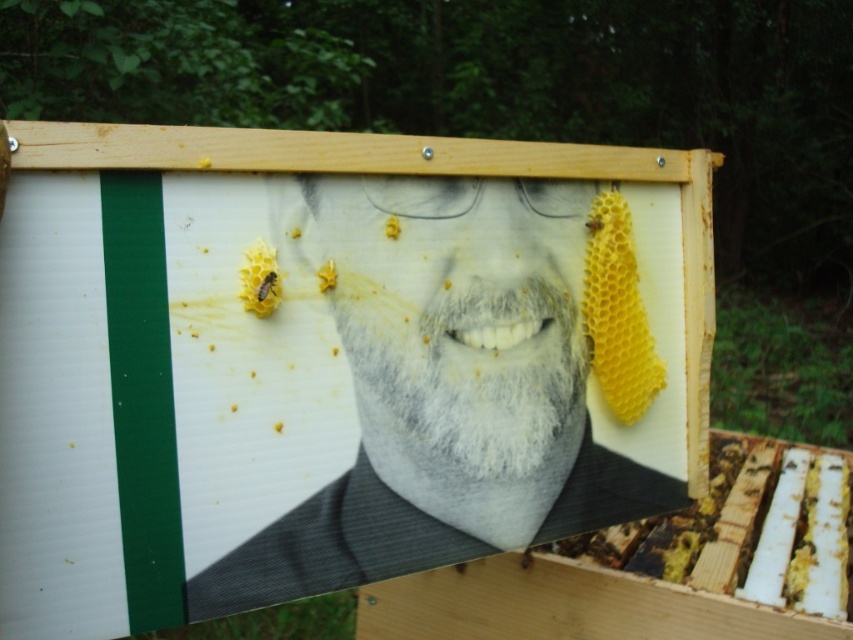
Can you confirm if gray matte portrait at center is smaller than translucent yellow honeycomb at center?

No, gray matte portrait at center is not smaller than translucent yellow honeycomb at center.

Is gray matte portrait at center positioned in front of translucent yellow honeycomb at center?

Yes, gray matte portrait at center is closer to the viewer.

Is point (445, 545) more distant than point (328, 268)?

Yes, it is.

Where is `gray matte portrait at center`? gray matte portrait at center is located at coordinates (459, 385).

Is point (561, 508) closer to camera compared to point (274, 289)?

No.

Does point (270, 600) come behind point (260, 300)?

Yes, point (270, 600) is behind point (260, 300).

Where is `gray matte portrait at center`? This screenshot has height=640, width=853. gray matte portrait at center is located at coordinates (459, 385).

Is gray matte face at center shorter than translucent yellow honeycomb at center?

In fact, gray matte face at center may be taller than translucent yellow honeycomb at center.

Which is behind, point (338, 314) or point (325, 280)?

Point (338, 314)

The image size is (853, 640). Identify the location of gray matte face at center. (451, 324).